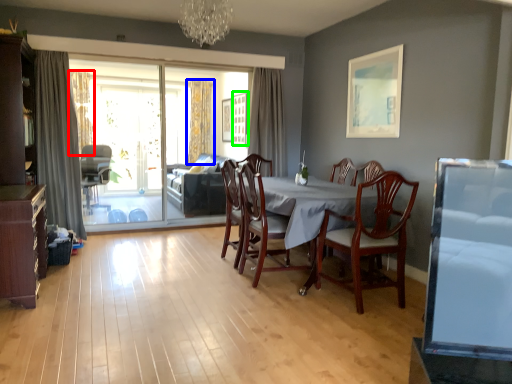
Question: Which object is positioned farthest from curtain (highlighted by a red box)? Select from curtain (highlighted by a blue box) and picture frame (highlighted by a green box).

Choices:
 (A) curtain
 (B) picture frame

Answer: (B)